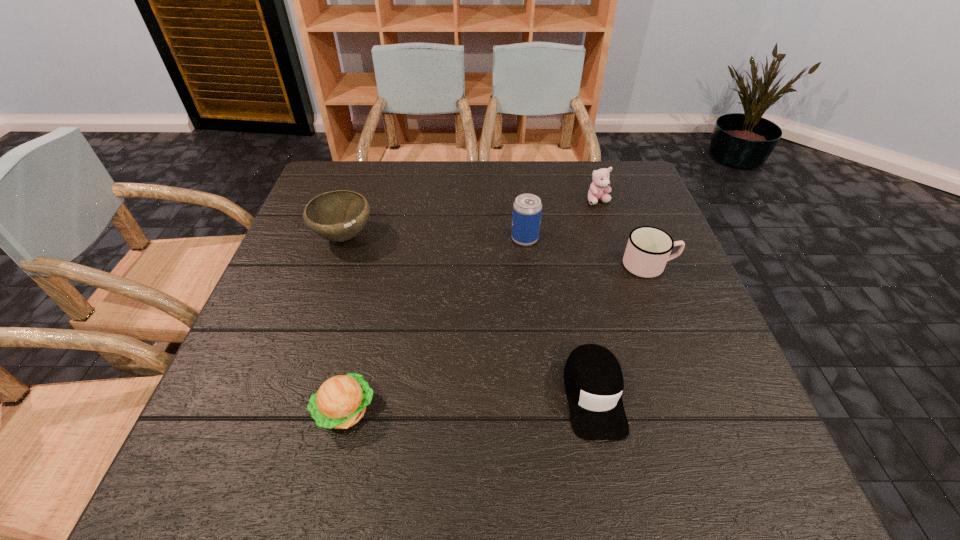
In order to click on vacant space in between the farthest object and the beer can in this screenshot , I will do 562,220.

At what (x,y) coordinates should I click in order to perform the action: click on unoccupied position between the third object from left to right and the farthest object. Please return your answer as a coordinate pair (x, y). The image size is (960, 540). Looking at the image, I should click on (562, 220).

What are the coordinates of `empty location between the hamburger and the mug` in the screenshot? It's located at pos(497,338).

Where is `the closest object relative to the fourth object from right to left`? Image resolution: width=960 pixels, height=540 pixels. the closest object relative to the fourth object from right to left is located at coordinates (600, 184).

Where is `object that is the fifth closest to the fourth object from left to right`? Image resolution: width=960 pixels, height=540 pixels. object that is the fifth closest to the fourth object from left to right is located at coordinates (340, 215).